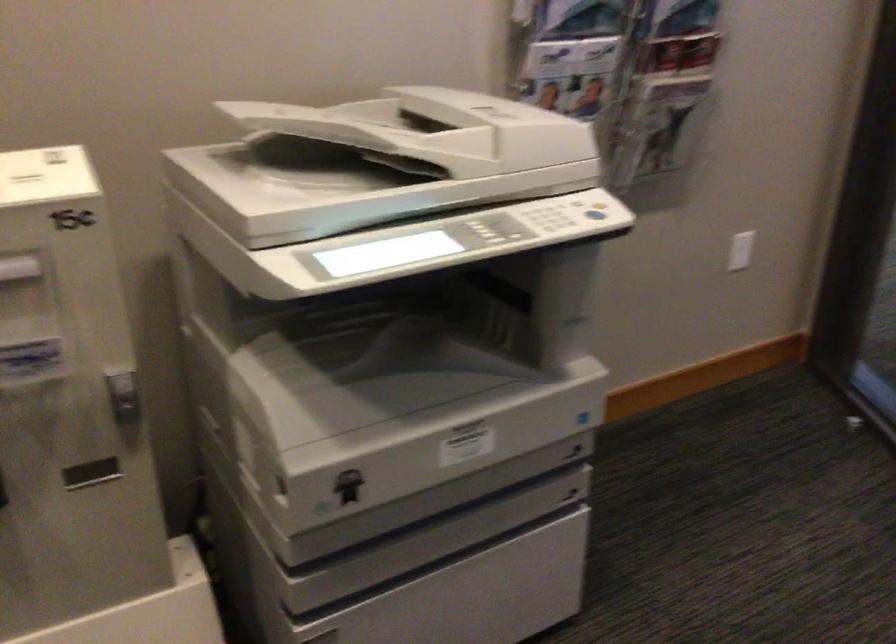
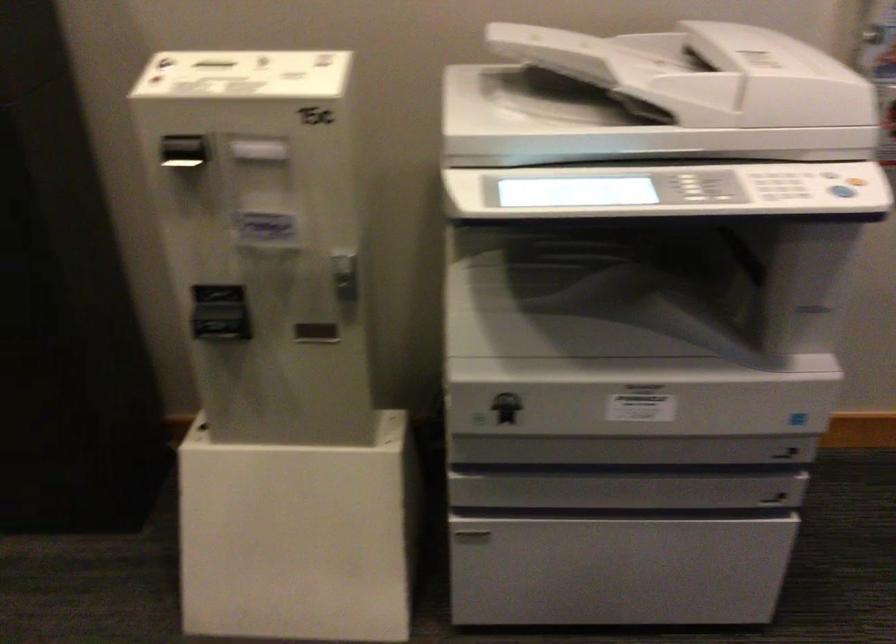
Find the pixel in the second image that matches point (582, 446) in the first image.

(790, 449)